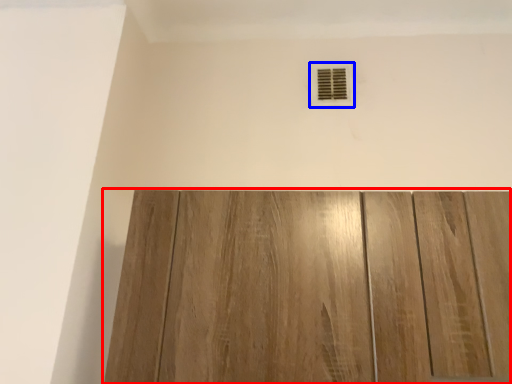
Question: Which of the following is the farthest to the observer, door (highlighted by a red box) or air conditioning (highlighted by a blue box)?

Choices:
 (A) door
 (B) air conditioning

Answer: (B)